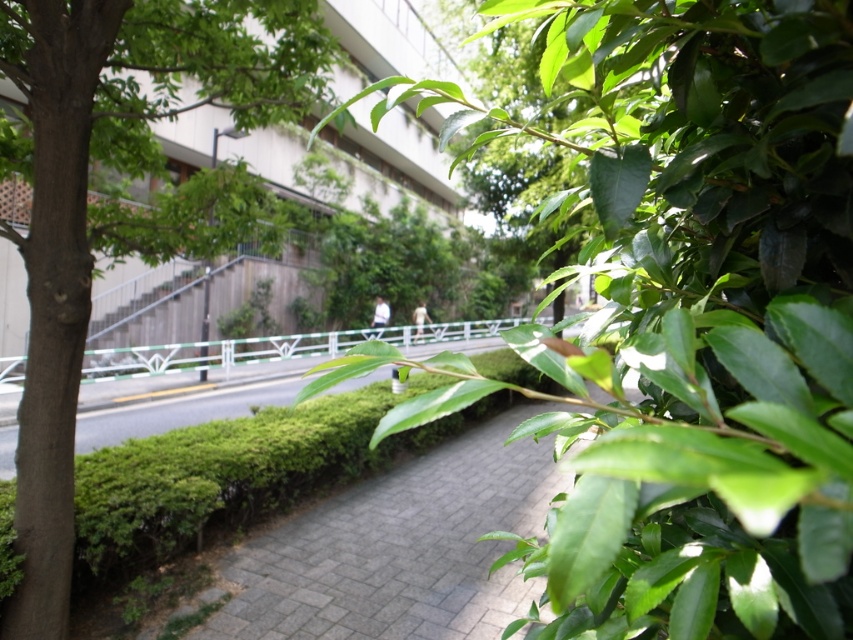
Question: Does green leafy tree at center appear over green leafy tree at left?

Choices:
 (A) no
 (B) yes

Answer: (A)

Question: Does green leafy tree at center have a lesser width compared to green leafy tree at left?

Choices:
 (A) no
 (B) yes

Answer: (B)

Question: Is green leafy tree at center smaller than green leafy tree at left?

Choices:
 (A) yes
 (B) no

Answer: (B)